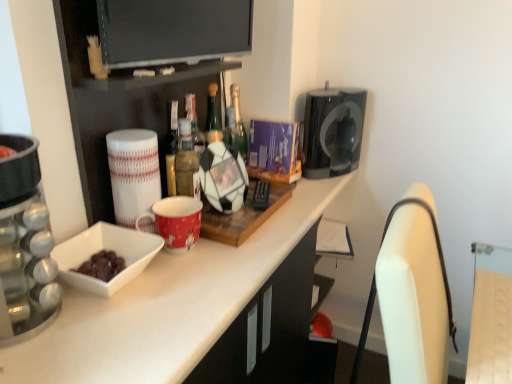
Image resolution: width=512 pixels, height=384 pixels. Identify the location of vacant area located to the right-hand side of white glossy bowl at center left. (197, 287).